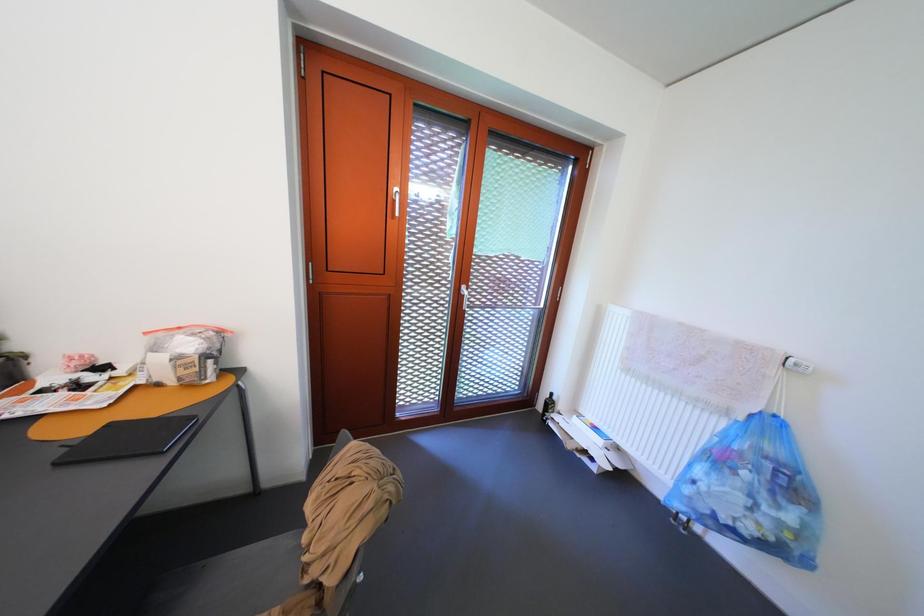
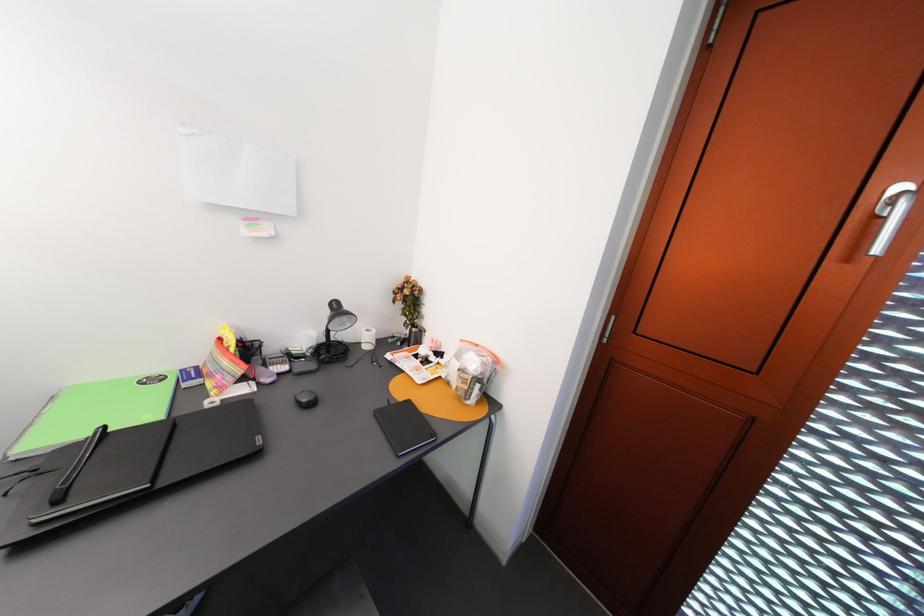
Question: The camera is either moving clockwise (left) or counter-clockwise (right) around the object. The first image is from the beginning of the video and the second image is from the end. Is the camera moving left or right when shooting the video?

Choices:
 (A) Left
 (B) Right

Answer: (B)